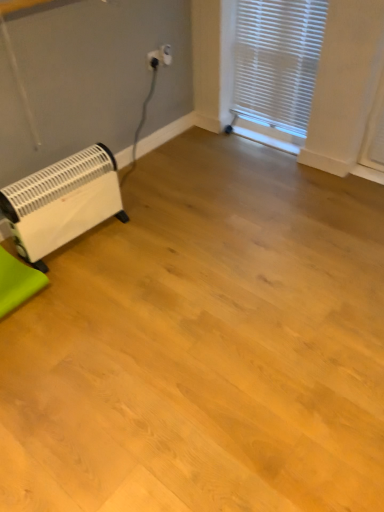
In order to face white plastic heater at lower left, should I rotate leftwards or rightwards?

Turn left by 15.747 degrees to look at white plastic heater at lower left.

This screenshot has height=512, width=384. What are the coordinates of `white plastic electric outlet at upper center` in the screenshot? It's located at (165, 54).

Locate an element on the screen. white plastic heater at lower left is located at coordinates (62, 202).

Considering the sizes of white plastic blinds at upper right and green fabric at lower left in the image, is white plastic blinds at upper right wider or thinner than green fabric at lower left?

white plastic blinds at upper right is thinner than green fabric at lower left.

From the image's perspective, is white plastic blinds at upper right above or below green fabric at lower left?

Clearly, from the image's perspective, white plastic blinds at upper right is above green fabric at lower left.

In the image, there is a green fabric at lower left. At what (x,y) coordinates should I click in order to perform the action: click on window blind above it (from the image's perspective). Please return your answer as a coordinate pair (x, y). The image size is (384, 512). Looking at the image, I should click on (277, 61).

Which object is further away from the camera, white plastic blinds at upper right or green fabric at lower left?

white plastic blinds at upper right is more distant.

Is green fabric at lower left aimed at white plastic heater at lower left?

No, green fabric at lower left is not turned towards white plastic heater at lower left.

From the image's perspective, is green fabric at lower left located beneath white plastic heater at lower left?

Yes.

Consider the image. Based on their positions, is green fabric at lower left located to the left or right of white plastic heater at lower left?

In the image, green fabric at lower left appears on the left side of white plastic heater at lower left.

Can green fabric at lower left be found inside white plastic heater at lower left?

No, green fabric at lower left is not inside white plastic heater at lower left.

Can you confirm if white plastic heater at lower left is wider than green fabric at lower left?

No.

Is the surface of white plastic heater at lower left in direct contact with green fabric at lower left?

No, white plastic heater at lower left is not beside green fabric at lower left.

Would you say white plastic electric outlet at upper center is a long distance from white plastic blinds at upper right?

They are positioned close to each other.

From a real-world perspective, does white plastic electric outlet at upper center stand above white plastic blinds at upper right?

Yes, from a real-world perspective, white plastic electric outlet at upper center is on top of white plastic blinds at upper right.

Which of these two, white plastic electric outlet at upper center or white plastic blinds at upper right, is thinner?

With smaller width is white plastic electric outlet at upper center.

The height and width of the screenshot is (512, 384). I want to click on electric outlet above the white plastic blinds at upper right (from a real-world perspective), so click(165, 54).

Visually, is green fabric at lower left positioned to the left or to the right of white plastic blinds at upper right?

Based on their positions, green fabric at lower left is located to the left of white plastic blinds at upper right.

From the image's perspective, is green fabric at lower left above white plastic blinds at upper right?

No, from the image's perspective, green fabric at lower left is not on top of white plastic blinds at upper right.

Is green fabric at lower left far away from white plastic blinds at upper right?

Indeed, green fabric at lower left is not near white plastic blinds at upper right.

From a real-world perspective, between green fabric at lower left and white plastic blinds at upper right, who is vertically lower?

From a 3D spatial view, green fabric at lower left is below.

Which object is wider, white plastic blinds at upper right or white plastic electric outlet at upper center?

white plastic blinds at upper right is wider.

How different are the orientations of white plastic blinds at upper right and white plastic electric outlet at upper center in degrees?

There is a 88.5-degree angle between the facing directions of white plastic blinds at upper right and white plastic electric outlet at upper center.

Is white plastic blinds at upper right facing away from white plastic electric outlet at upper center?

No, white plastic electric outlet at upper center is not at the back of white plastic blinds at upper right.

From the image's perspective, is white plastic blinds at upper right above or below white plastic electric outlet at upper center?

white plastic blinds at upper right is below white plastic electric outlet at upper center.

Do you think white plastic heater at lower left is within white plastic electric outlet at upper center, or outside of it?

white plastic heater at lower left exists outside the volume of white plastic electric outlet at upper center.

Locate an element on the screen. electric outlet above the white plastic heater at lower left (from a real-world perspective) is located at coordinates (165, 54).

Considering the sizes of objects white plastic heater at lower left and white plastic electric outlet at upper center in the image provided, who is bigger, white plastic heater at lower left or white plastic electric outlet at upper center?

With larger size is white plastic heater at lower left.

Looking at their sizes, would you say white plastic heater at lower left is wider or thinner than white plastic electric outlet at upper center?

Clearly, white plastic heater at lower left has more width compared to white plastic electric outlet at upper center.

This screenshot has width=384, height=512. I want to click on furniture in front of the white plastic blinds at upper right, so click(x=17, y=282).

There is a green fabric at lower left. Where is `appliance above it (from a real-world perspective)`? appliance above it (from a real-world perspective) is located at coordinates (62, 202).

Estimate the real-world distances between objects in this image. Which object is closer to white plastic heater at lower left, white plastic blinds at upper right or green fabric at lower left?

The object closer to white plastic heater at lower left is green fabric at lower left.

Considering their positions, is white plastic heater at lower left positioned closer to white plastic blinds at upper right than green fabric at lower left?

white plastic heater at lower left is closer to white plastic blinds at upper right.

Based on their spatial positions, is green fabric at lower left or white plastic heater at lower left closer to white plastic electric outlet at upper center?

The object closer to white plastic electric outlet at upper center is white plastic heater at lower left.

From the image, which object appears to be nearer to white plastic blinds at upper right, white plastic electric outlet at upper center or white plastic heater at lower left?

white plastic electric outlet at upper center is closer to white plastic blinds at upper right.

Estimate the real-world distances between objects in this image. Which object is further from green fabric at lower left, white plastic blinds at upper right or white plastic electric outlet at upper center?

white plastic blinds at upper right.

Which object lies nearer to the anchor point white plastic electric outlet at upper center, white plastic blinds at upper right or green fabric at lower left?

Among the two, white plastic blinds at upper right is located nearer to white plastic electric outlet at upper center.

Looking at the image, which one is located further to white plastic heater at lower left, white plastic blinds at upper right or white plastic electric outlet at upper center?

The object further to white plastic heater at lower left is white plastic blinds at upper right.

When comparing their distances from white plastic heater at lower left, does green fabric at lower left or white plastic electric outlet at upper center seem closer?

Based on the image, green fabric at lower left appears to be nearer to white plastic heater at lower left.

In order to click on appliance located between green fabric at lower left and white plastic blinds at upper right in the left-right direction in this screenshot , I will do click(x=62, y=202).

In order to click on appliance between white plastic electric outlet at upper center and green fabric at lower left from top to bottom in this screenshot , I will do 62,202.

Locate an element on the screen. Image resolution: width=384 pixels, height=512 pixels. window blind between white plastic electric outlet at upper center and green fabric at lower left in the vertical direction is located at coordinates (277, 61).

You are a GUI agent. You are given a task and a screenshot of the screen. Output one action in this format:
    pyautogui.click(x=<x>, y=<y>)
    Task: Click on the electric outlet situated between white plastic heater at lower left and white plastic blinds at upper right from left to right
    The image size is (384, 512).
    Given the screenshot: What is the action you would take?
    pyautogui.click(x=165, y=54)